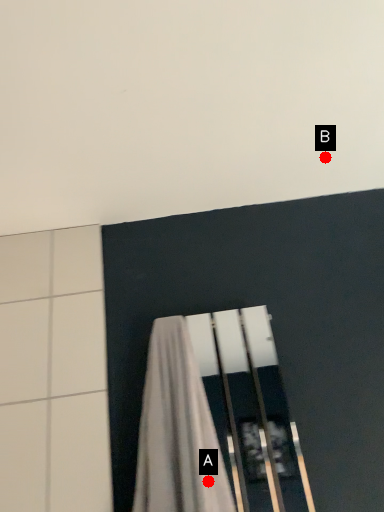
Question: Two points are circled on the image, labeled by A and B beside each circle. Which point is farther to the camera?

Choices:
 (A) A is further
 (B) B is further

Answer: (B)